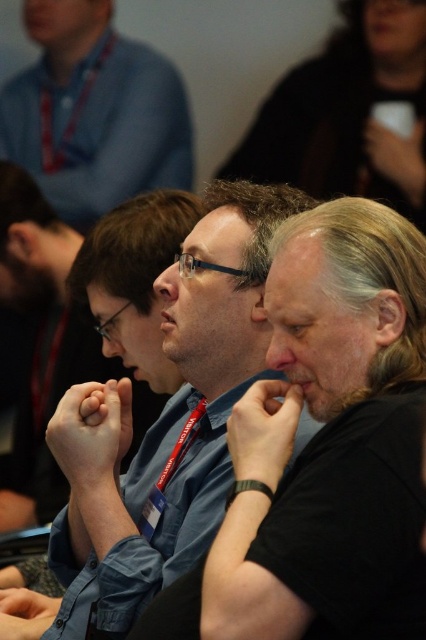
Which is below, matte blue shirt at center or gray matte hair at center?

matte blue shirt at center

Between matte blue shirt at center and gray matte hair at center, which one appears on the left side from the viewer's perspective?

matte blue shirt at center

What do you see at coordinates (324, 449) in the screenshot?
I see `matte blue shirt at center` at bounding box center [324, 449].

I want to click on matte blue shirt at center, so click(324, 449).

Between point (271, 436) and point (66, 74), which one is positioned in front?

Point (271, 436) is more forward.

Is matte blue shirt at center in front of blue shirt at upper left?

Yes, it is in front of blue shirt at upper left.

Between point (317, 250) and point (86, 152), which one is positioned in front?

Point (317, 250) is more forward.

You are a GUI agent. You are given a task and a screenshot of the screen. Output one action in this format:
    pyautogui.click(x=<x>, y=<y>)
    Task: Click on the matte blue shirt at center
    
    Given the screenshot: What is the action you would take?
    pyautogui.click(x=324, y=449)

Can you confirm if blue shirt at upper left is positioned below gray matte hair at center?

No.

Which is behind, point (140, 49) or point (409, 218)?

Point (140, 49)

Where is `blue shirt at upper left`? blue shirt at upper left is located at coordinates (94, 113).